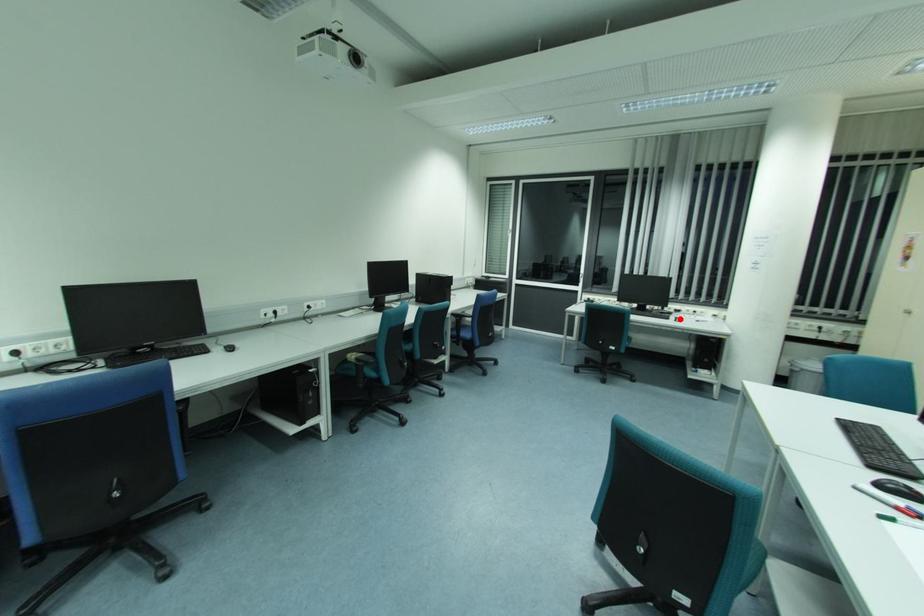
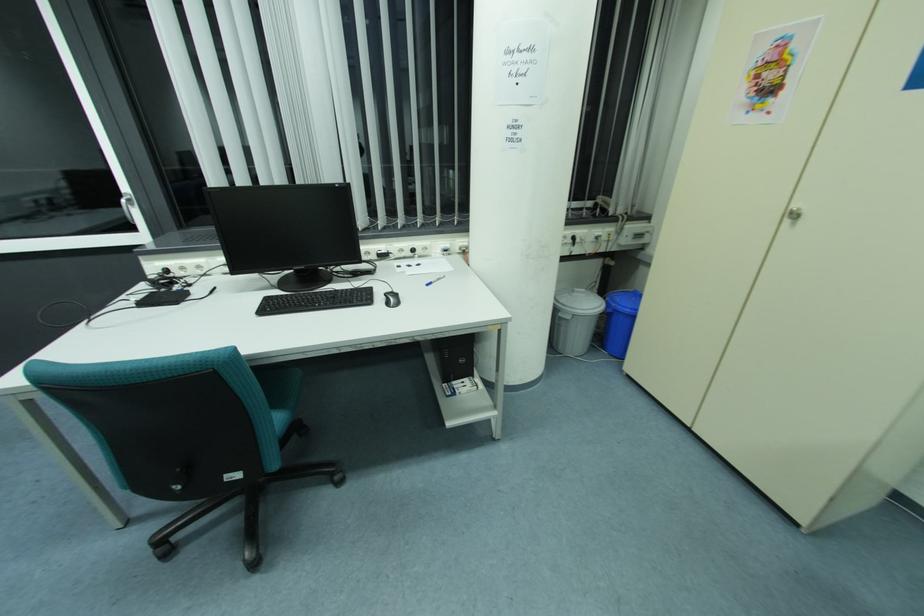
The point at the highlighted location is marked in the first image. Where is the corresponding point in the second image?

(396, 296)